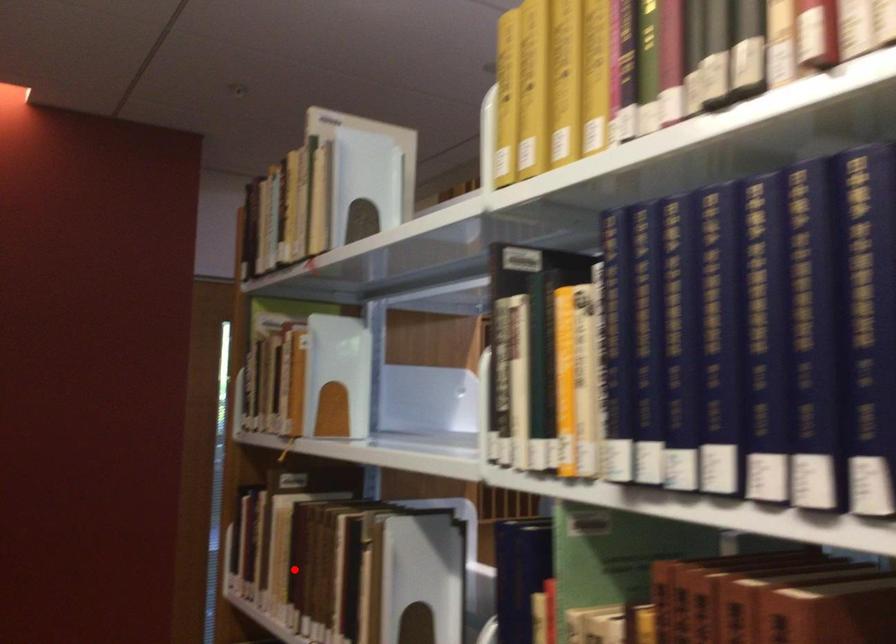
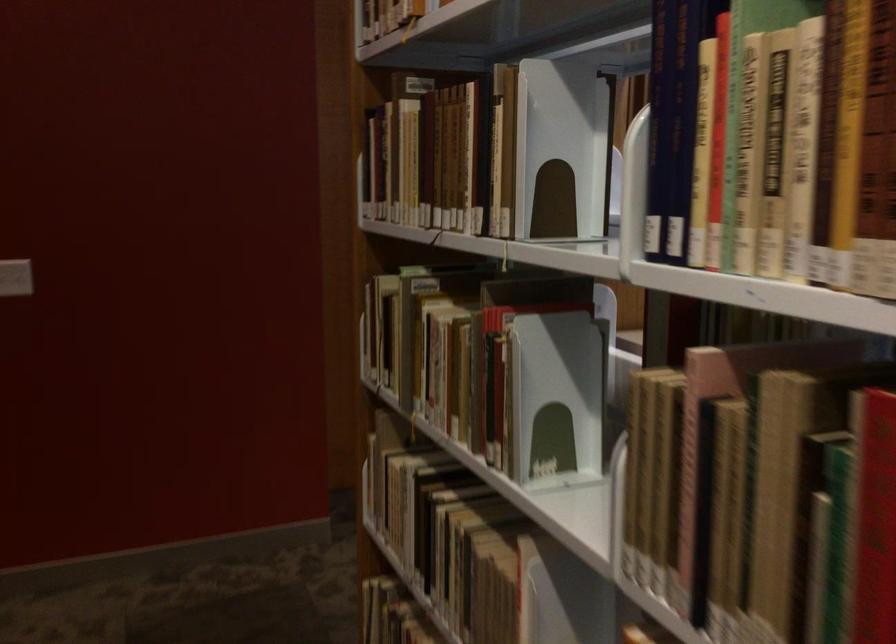
In the second image, find the point that corresponds to the highlighted location in the first image.

(425, 158)